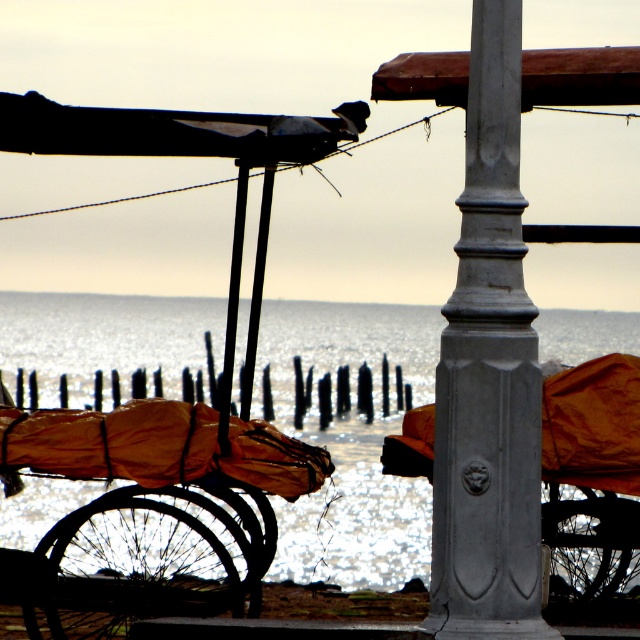
Question: Is the position of shiny metallic water at center more distant than that of gray polished metal pole at center?

Choices:
 (A) yes
 (B) no

Answer: (A)

Question: Does shiny metallic water at center come in front of gray polished metal pole at center?

Choices:
 (A) yes
 (B) no

Answer: (B)

Question: Which of the following is the farthest from the observer?

Choices:
 (A) shiny metallic water at center
 (B) gray polished metal pole at center

Answer: (A)

Question: Does shiny metallic water at center come in front of gray polished metal pole at center?

Choices:
 (A) yes
 (B) no

Answer: (B)